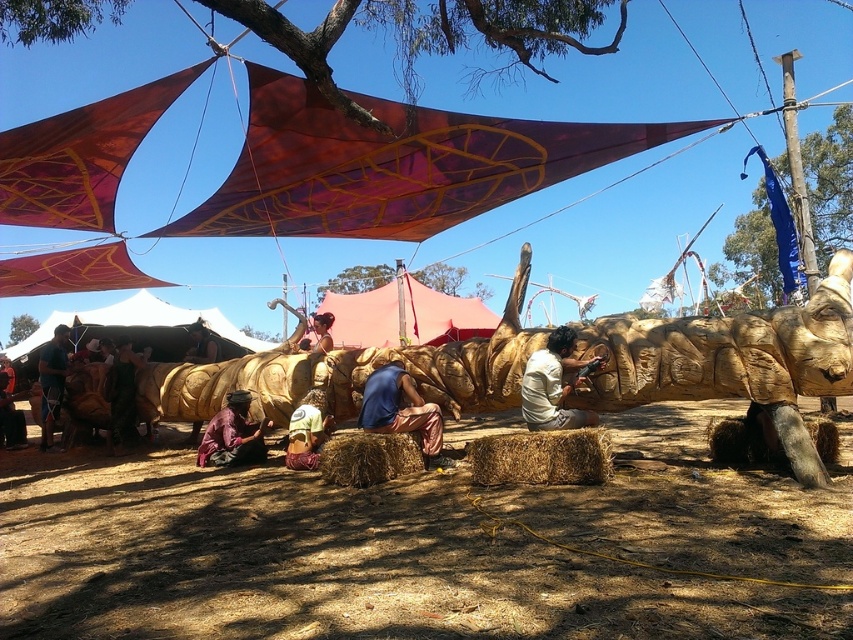
Does point (729, 442) lie in front of point (244, 435)?

Yes, it is.

Can you confirm if brown straw bale at lower right is shorter than brown woven fabric at lower center?

Indeed, brown straw bale at lower right has a lesser height compared to brown woven fabric at lower center.

Identify the location of brown straw bale at lower right. (741, 442).

The image size is (853, 640). Find the location of `brown straw bale at lower right`. brown straw bale at lower right is located at coordinates (741, 442).

Looking at this image, can you confirm if brown dirt field at center is wider than dark brown wood at lower left?

Yes, brown dirt field at center is wider than dark brown wood at lower left.

Who is more forward, (293,620) or (132,419)?

Point (293,620) is more forward.

Image resolution: width=853 pixels, height=640 pixels. I want to click on brown dirt field at center, so click(x=419, y=548).

Does blue fabric flag at upper right have a lesser width compared to brown straw bale at center?

No, blue fabric flag at upper right is not thinner than brown straw bale at center.

Is blue fabric flag at upper right below brown straw bale at center?

No, blue fabric flag at upper right is not below brown straw bale at center.

Where is `blue fabric flag at upper right`? The height and width of the screenshot is (640, 853). blue fabric flag at upper right is located at coordinates (828, 182).